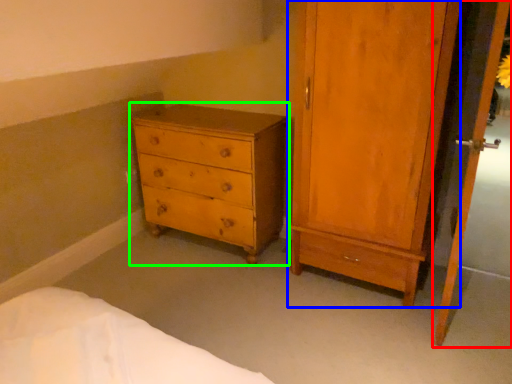
Question: Estimate the real-world distances between objects in this image. Which object is closer to screen door (highlighted by a red box), door (highlighted by a blue box) or chest of drawers (highlighted by a green box)?

Choices:
 (A) door
 (B) chest of drawers

Answer: (A)